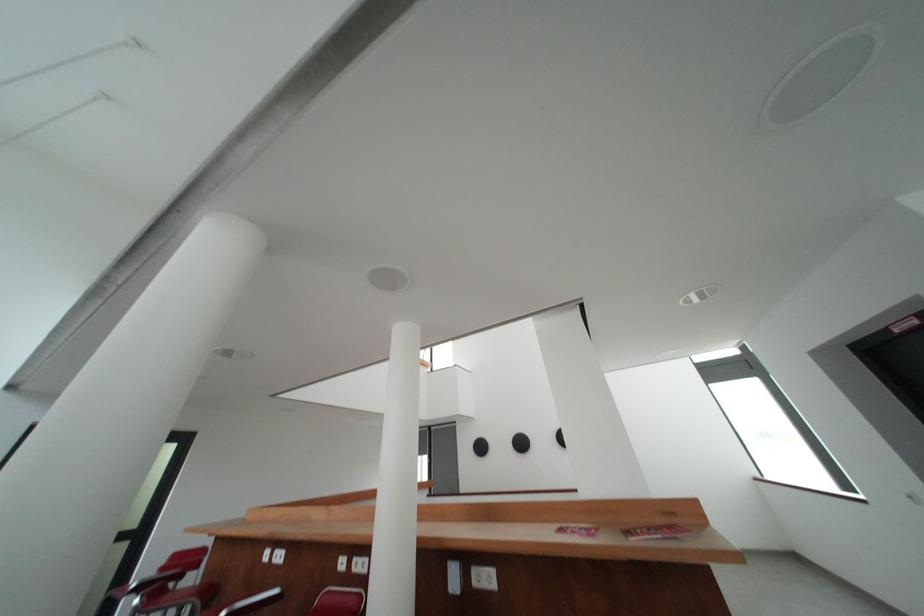
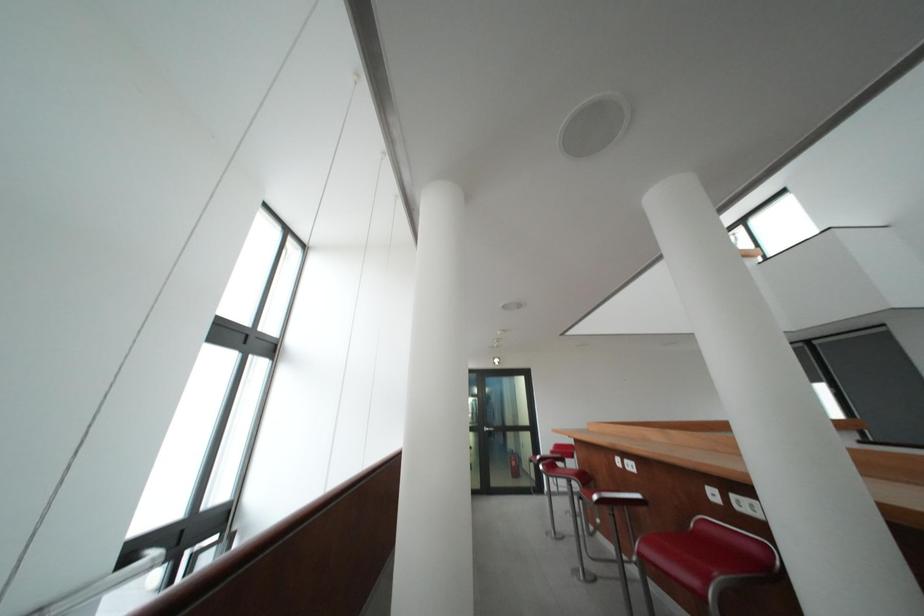
Question: The images are taken continuously from a first-person perspective. In which direction is your viewpoint rotating?

Choices:
 (A) Left
 (B) Right
 (C) Up
 (D) Down

Answer: (A)